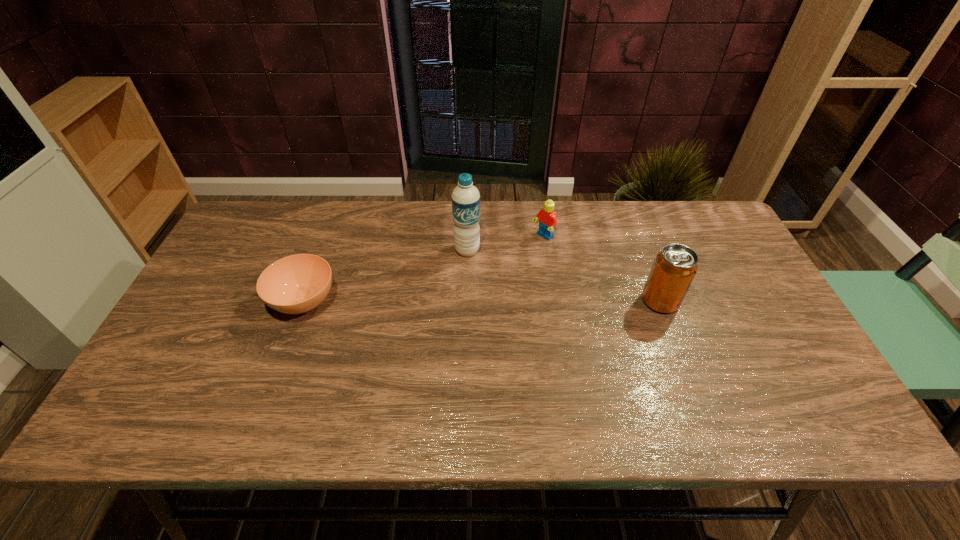
Locate an element on the screen. The height and width of the screenshot is (540, 960). free spot at the left edge of the desktop is located at coordinates (252, 269).

The width and height of the screenshot is (960, 540). In the image, there is a desktop. What are the coordinates of `free space at the right edge` in the screenshot? It's located at (751, 315).

Identify the location of free spot at the far left corner of the desktop. (233, 247).

In the image, there is a desktop. Where is `vacant space at the far right corner`? This screenshot has width=960, height=540. vacant space at the far right corner is located at coordinates (666, 210).

Identify the location of empty space between the water bottle and the soup bowl. (386, 276).

Locate an element on the screen. vacant space that is in between the third shortest object and the shortest object is located at coordinates (482, 301).

In order to click on free space that is in between the tallest object and the soda can in this screenshot , I will do `click(564, 276)`.

Identify the location of vacant space that is in between the third object from left to right and the water bottle. (505, 244).

Locate an element on the screen. This screenshot has height=540, width=960. vacant area that lies between the second shortest object and the rightmost object is located at coordinates (601, 269).

I want to click on vacant point located between the leftmost object and the third shortest object, so click(482, 301).